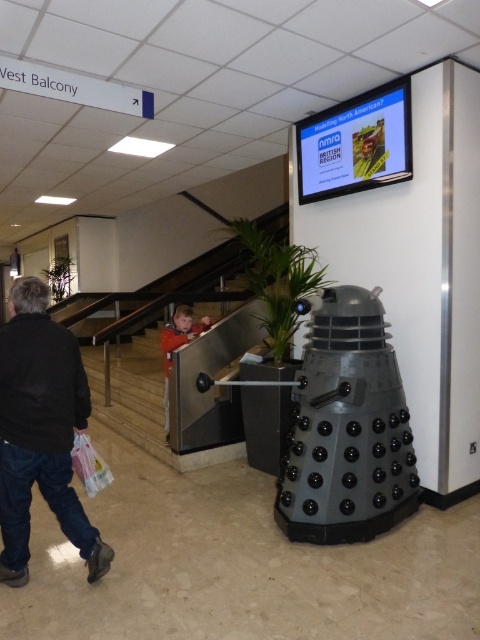
You are standing in the public building and see the black matte jacket at lower left. Where is the black matte jacket located in the scene?

The black matte jacket at lower left is located at point [40,429] in the scene.

You are standing in the exhibition hall and see both the black matte jacket at lower left and the orange fleece jacket at lower center. If you want to pick up both jackets, which one do you need to walk towards first to reach the closer one?

The black matte jacket at lower left is 6.72 feet away from the orange fleece jacket at lower center. Since you are standing in the exhibition hall, you need to determine which is closer to your current position. However, the distance between the two jackets is provided, but your exact position isn